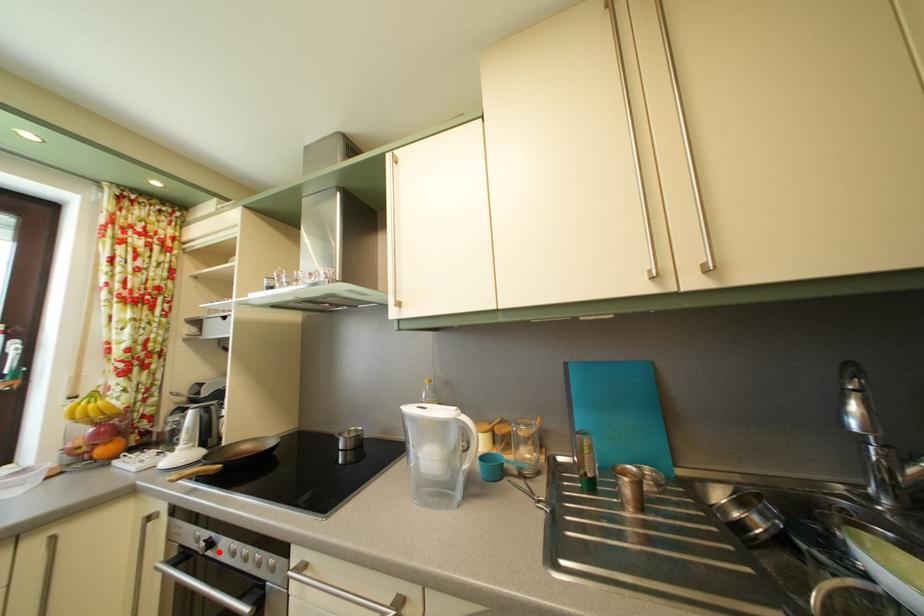
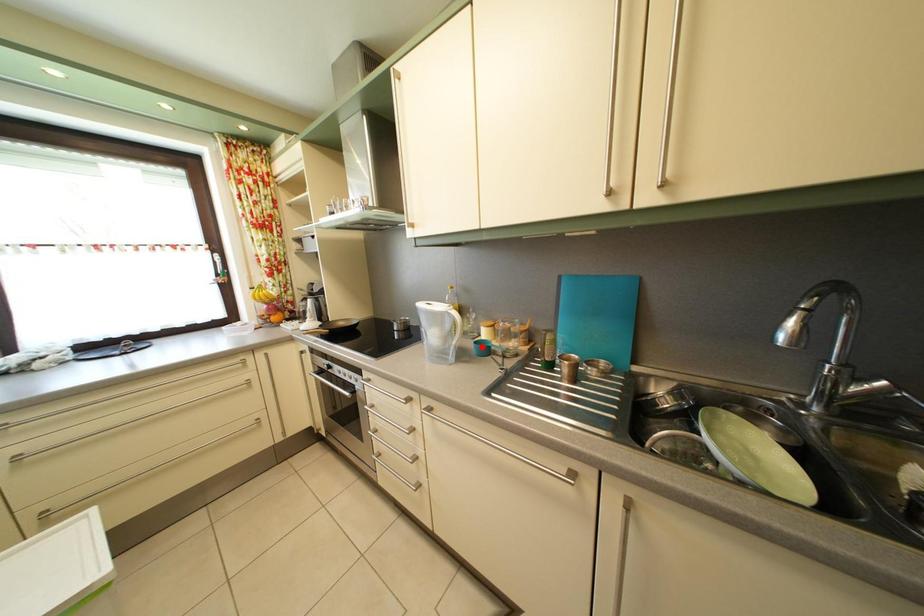
I am providing you with two images of the same scene from different viewpoints. A red point is marked on the first image and another point is marked on the second image. Are the points marked in image1 and image2 representing the same 3D position?

No